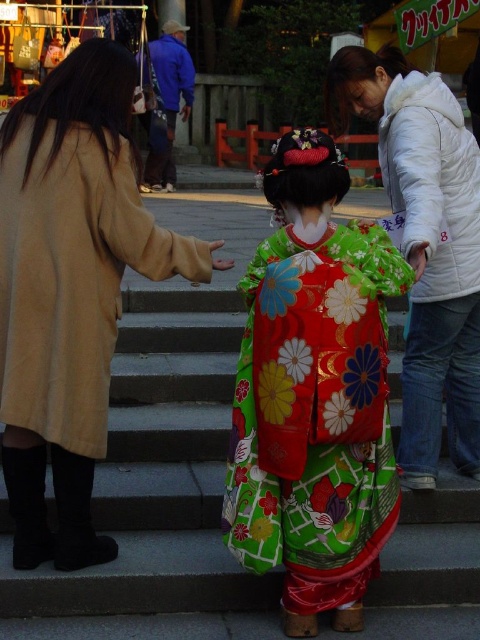
Does point (360, 525) come behind point (96, 512)?

No, it is in front of (96, 512).

Does floral silk kimono at center have a lesser height compared to smooth concrete stairs at center?

In fact, floral silk kimono at center may be taller than smooth concrete stairs at center.

Who is more forward, (334, 461) or (22, 589)?

Positioned in front is point (334, 461).

Locate an element on the screen. floral silk kimono at center is located at coordinates (313, 394).

In the scene shown: Is floral silk kimono at center positioned in front of white puffy jacket at upper right?

That is True.

Which is behind, point (289, 134) or point (430, 381)?

The point (430, 381) is more distant.

Is point (359, 538) in front of point (431, 113)?

Yes, point (359, 538) is in front of point (431, 113).

This screenshot has height=640, width=480. What are the coordinates of `floral silk kimono at center` in the screenshot? It's located at (x=313, y=394).

Can you confirm if smooth concrete stairs at center is positioned to the right of white puffy jacket at upper right?

In fact, smooth concrete stairs at center is to the left of white puffy jacket at upper right.

Who is more forward, (130, 310) or (467, 372)?

Point (467, 372)

Where is `smooth concrete stairs at center`? The image size is (480, 640). smooth concrete stairs at center is located at coordinates point(157,474).